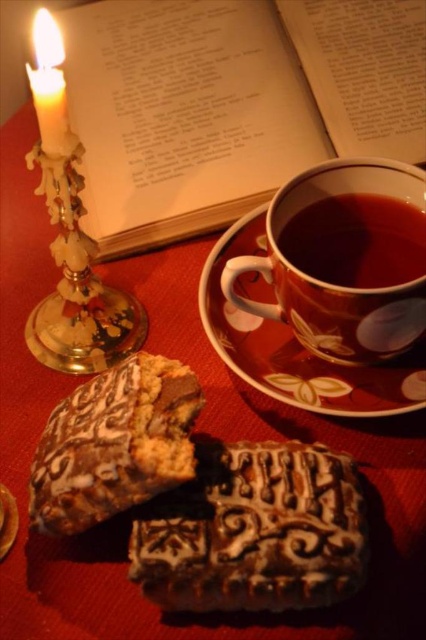
Question: Does brown textured cookie at center have a larger size compared to brown glossy mug at upper center?

Choices:
 (A) no
 (B) yes

Answer: (B)

Question: Can you confirm if paper book at upper center is bigger than white wax candle at upper left?

Choices:
 (A) no
 (B) yes

Answer: (B)

Question: Which point is closer to the camera?

Choices:
 (A) (118, 384)
 (B) (353, 189)
 (C) (348, 214)

Answer: (A)

Question: Which object is farther from the camera taking this photo?

Choices:
 (A) white wax candle at upper left
 (B) brown textured cookie at center
 (C) matte ceramic cup at upper right

Answer: (C)

Question: Is brown textured cookie at center bigger than brown glossy mug at upper center?

Choices:
 (A) yes
 (B) no

Answer: (A)

Question: Which of these objects is positioned farthest from the white wax candle at upper left?

Choices:
 (A) matte ceramic cup at upper right
 (B) gold metallic candle holder at left

Answer: (A)